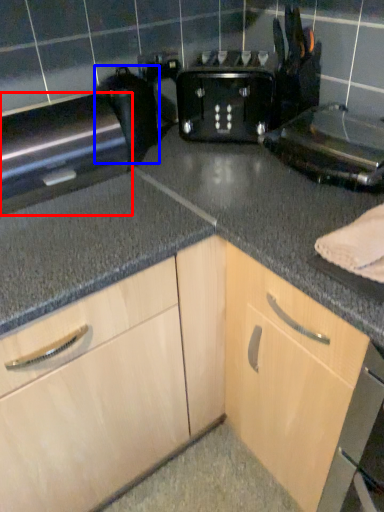
Question: Which object appears closest to the camera in this image, appliance (highlighted by a red box) or appliance (highlighted by a blue box)?

Choices:
 (A) appliance
 (B) appliance

Answer: (A)